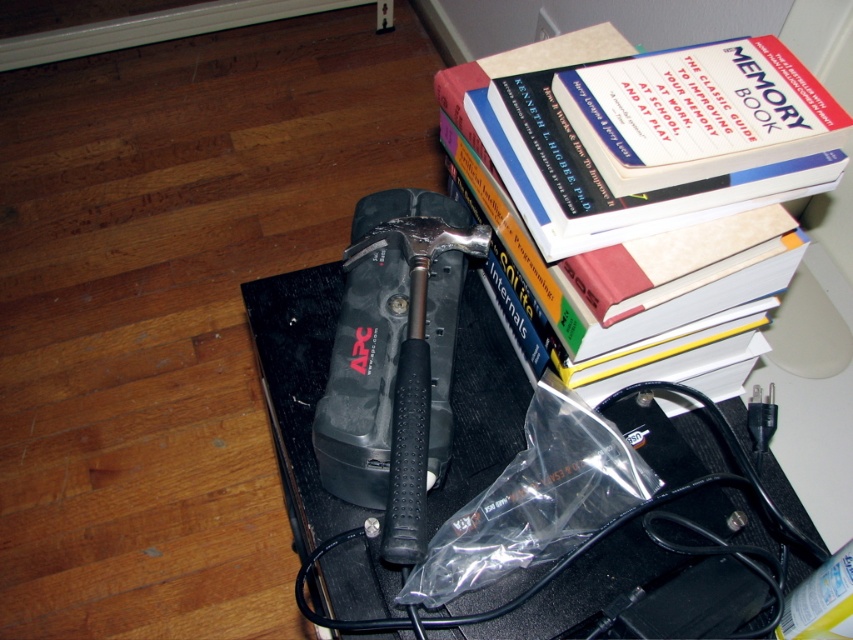
Is the position of black plastic table at center less distant than that of black rubberized hammer at center?

No, black plastic table at center is further to the viewer.

Is point (325, 579) closer to camera compared to point (445, 212)?

Yes, point (325, 579) is closer to viewer.

Locate an element on the screen. Image resolution: width=853 pixels, height=640 pixels. black plastic table at center is located at coordinates (299, 388).

Measure the distance between point (372, 246) and camera.

A distance of 29.79 inches exists between point (372, 246) and camera.

Does black rubberized hammer at center come in front of hardcover book at upper right?

Yes.

Who is more distant from viewer, [389,349] or [727,253]?

The point [389,349] is behind.

What are the coordinates of `black rubberized hammer at center` in the screenshot? It's located at (395, 360).

Who is positioned more to the right, black plastic table at center or hardcover book at upper right?

hardcover book at upper right

Which is above, black plastic table at center or hardcover book at upper right?

hardcover book at upper right is higher up.

This screenshot has width=853, height=640. Describe the element at coordinates (299, 388) in the screenshot. I see `black plastic table at center` at that location.

The image size is (853, 640). What are the coordinates of `black plastic table at center` in the screenshot? It's located at (299, 388).